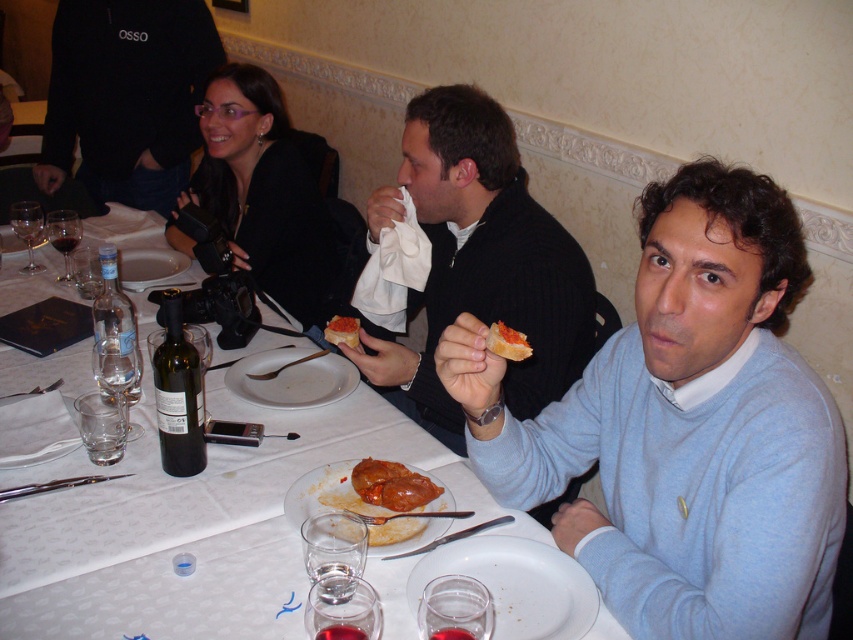
You are a customer at this restaurant and want to know where the red glossy meat at center is placed relative to the smooth tomato paste at center. Can you describe their positions?

The red glossy meat at center is located below the smooth tomato paste at center.

Based on the coordinates provided, can you identify which object is located at point (685,426)?

The point (685,426) marks the location of the light blue sweater at center.